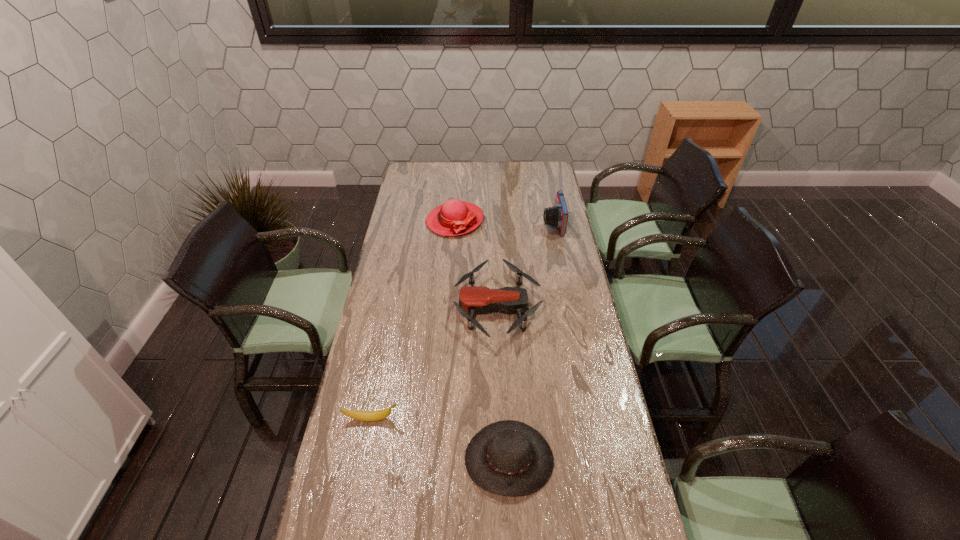
What are the coordinates of `vacant area that lies between the second nearest object and the third farthest object` in the screenshot? It's located at (435, 363).

Identify the location of object that is the nearest to the rightmost object. The height and width of the screenshot is (540, 960). (473, 300).

The image size is (960, 540). I want to click on the third closest object to the camera, so click(509, 458).

Identify the location of vacant position in the image that satisfies the following two spatial constraints: 1. at the front of the second tallest object with a bow; 2. at the stem of the banana. This screenshot has width=960, height=540. (441, 418).

Find the location of `vacant position in the image that satisfies the following two spatial constraints: 1. at the front of the taller hat with a bow; 2. at the stem of the fourth farthest object`. vacant position in the image that satisfies the following two spatial constraints: 1. at the front of the taller hat with a bow; 2. at the stem of the fourth farthest object is located at coordinates (441, 418).